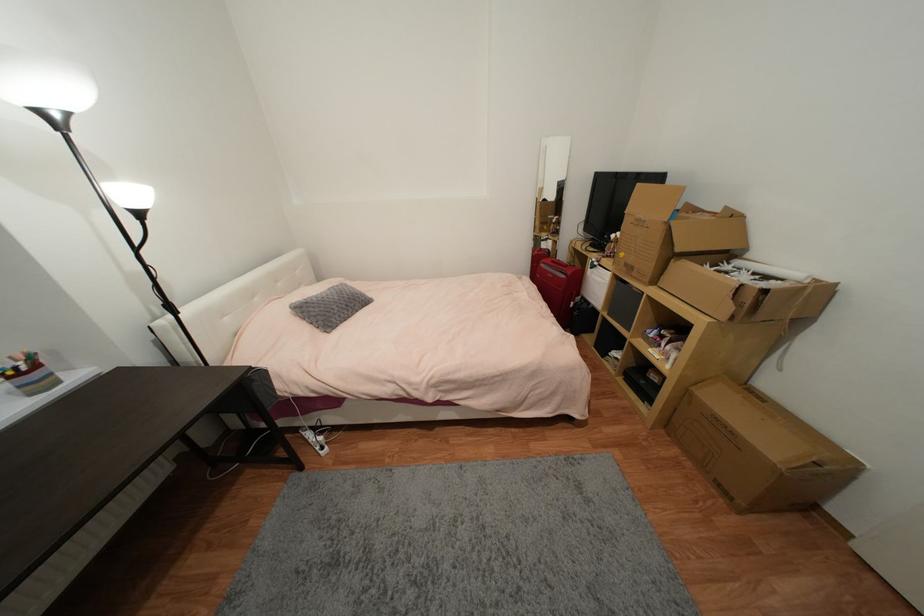
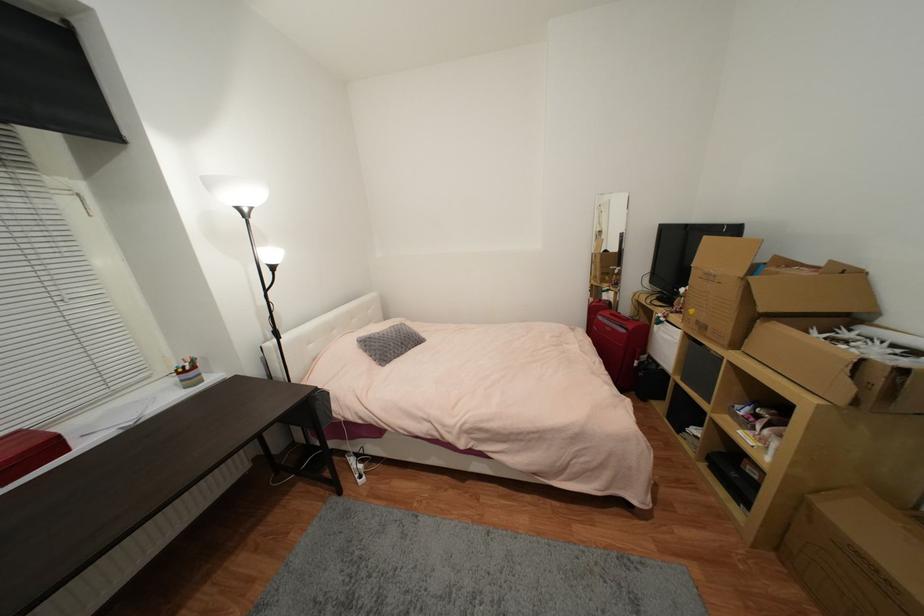
Where in the second image is the point corresponding to (x=634, y=270) from the first image?

(708, 329)